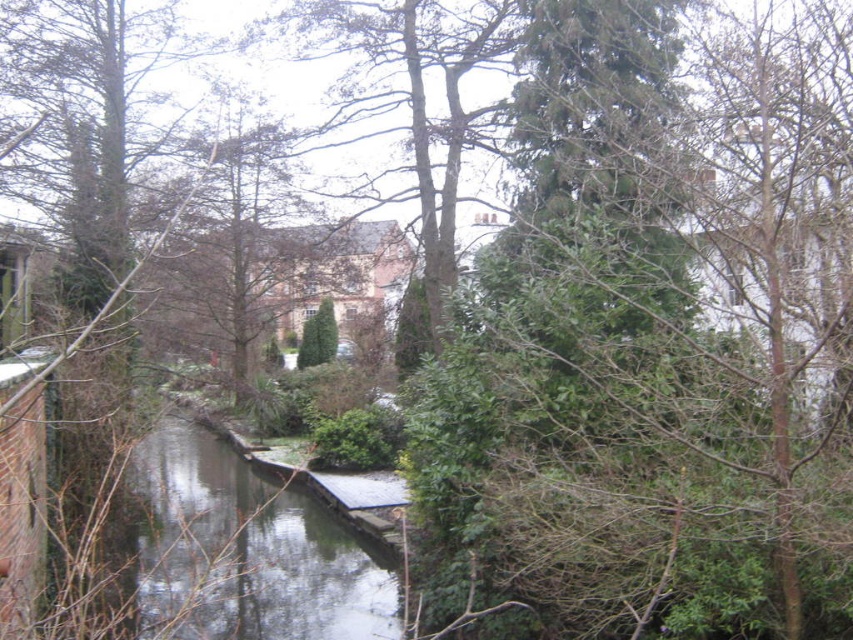
Is smooth bark tree at center taller than green leafy tree at center?

Incorrect, smooth bark tree at center's height is not larger of green leafy tree at center's.

Is the position of smooth bark tree at center more distant than that of green leafy tree at center?

That is False.

Is point (421, 10) closer to viewer compared to point (334, 352)?

Yes, it is.

The height and width of the screenshot is (640, 853). I want to click on smooth bark tree at center, so click(x=408, y=99).

Which is below, smooth bark tree at center or brown leafy tree at center?

brown leafy tree at center is below.

Looking at this image, does smooth bark tree at center have a smaller size compared to brown leafy tree at center?

Correct, smooth bark tree at center occupies less space than brown leafy tree at center.

This screenshot has width=853, height=640. I want to click on smooth bark tree at center, so [408, 99].

Can you confirm if clear water at center is bigger than brown leafy tree at center?

No, clear water at center is not bigger than brown leafy tree at center.

Identify the location of clear water at center. 245,548.